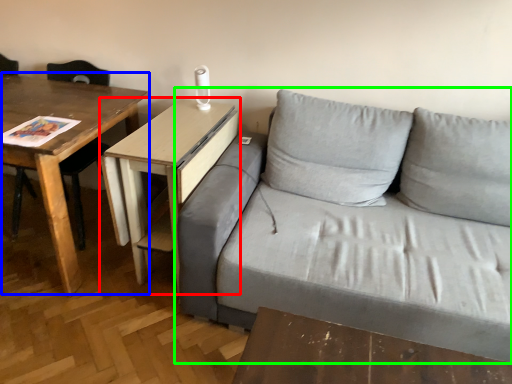
Question: Which is nearer to the table (highlighted by a red box)? table (highlighted by a blue box) or studio couch (highlighted by a green box).

Choices:
 (A) table
 (B) studio couch

Answer: (A)